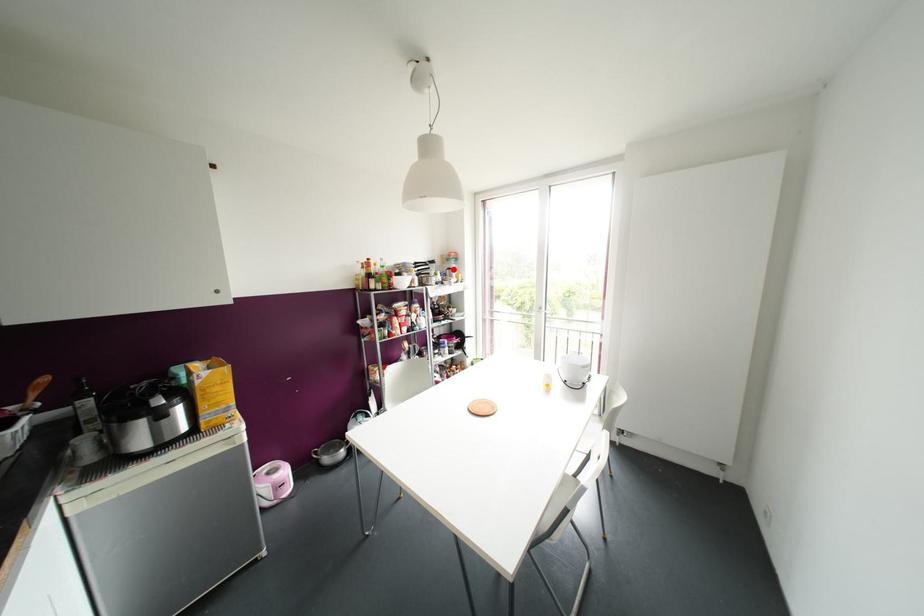
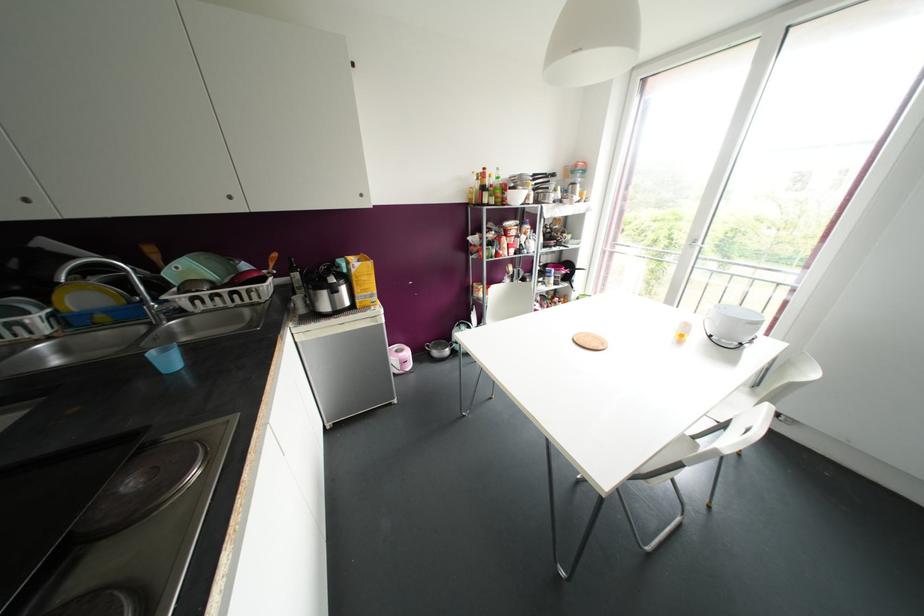
Where in the second image is the point corresponding to the highlighted location from the first image?

(578, 185)